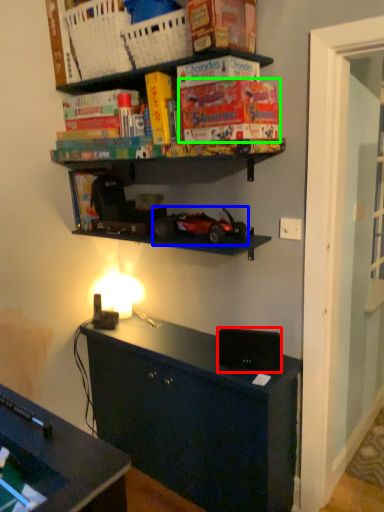
Question: Based on their relative distances, which object is nearer to speaker (highlighted by a red box)? Choose from model car (highlighted by a blue box) and paperback book (highlighted by a green box).

Choices:
 (A) model car
 (B) paperback book

Answer: (A)